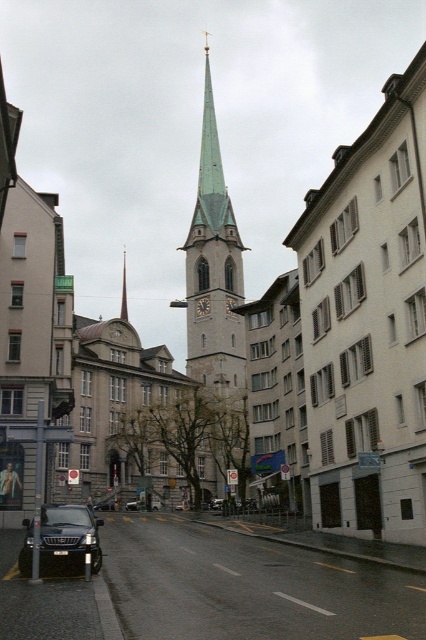
Who is more distant from viewer, [45,516] or [131,502]?

Positioned behind is point [131,502].

Is the position of shiny black suv at lower left less distant than that of shiny black sedan at center?

Yes.

Is point (94, 518) more distant than point (158, 502)?

That is False.

This screenshot has height=640, width=426. In order to click on shiny black suv at lower left in this screenshot , I will do `click(69, 534)`.

Which is above, white smooth building at center or green stone spire at center?

Positioned higher is green stone spire at center.

Measure the distance between point (422, 396) and camera.

Point (422, 396) and camera are 42.63 meters apart.

You are a GUI agent. You are given a task and a screenshot of the screen. Output one action in this format:
    pyautogui.click(x=<x>, y=<y>)
    Task: Click on the white smooth building at center
    Image resolution: width=426 pixels, height=640 pixels.
    Given the screenshot: What is the action you would take?
    pyautogui.click(x=368, y=323)

In the scene shown: Which is above, white smooth building at center or green stone clock tower at center?

green stone clock tower at center

Is white smooth building at center thinner than green stone clock tower at center?

Correct, white smooth building at center's width is less than green stone clock tower at center's.

This screenshot has width=426, height=640. What are the coordinates of `white smooth building at center` in the screenshot? It's located at (368, 323).